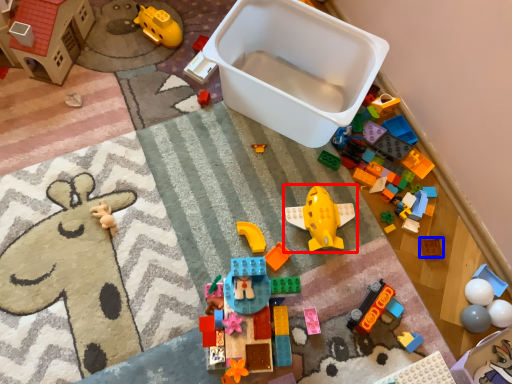
Question: Which point is closer to the camera, toy (highlighted by a red box) or toy (highlighted by a blue box)?

Choices:
 (A) toy
 (B) toy

Answer: (A)